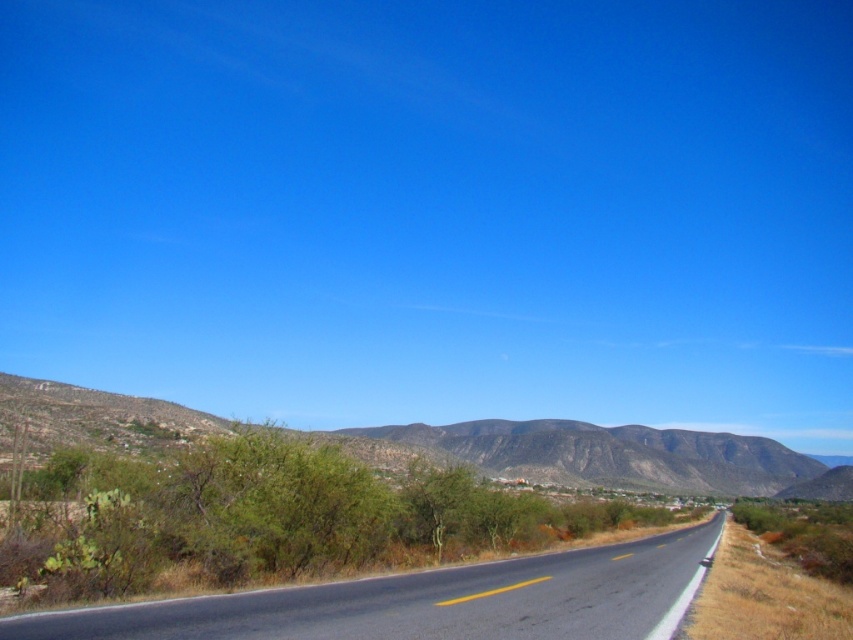
Question: Does black asphalt road at center appear over green shrubbery at lower left?

Choices:
 (A) no
 (B) yes

Answer: (B)

Question: Which of the following is the farthest from the observer?

Choices:
 (A) (379, 588)
 (B) (822, 481)

Answer: (B)

Question: Does black asphalt road at center come in front of green shrubbery at lower left?

Choices:
 (A) yes
 (B) no

Answer: (A)

Question: Does black asphalt road at center appear on the right side of green shrubbery at lower left?

Choices:
 (A) yes
 (B) no

Answer: (B)